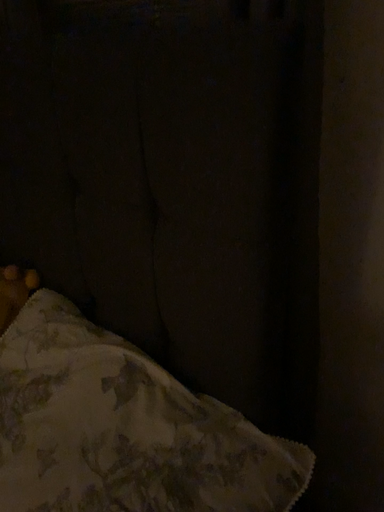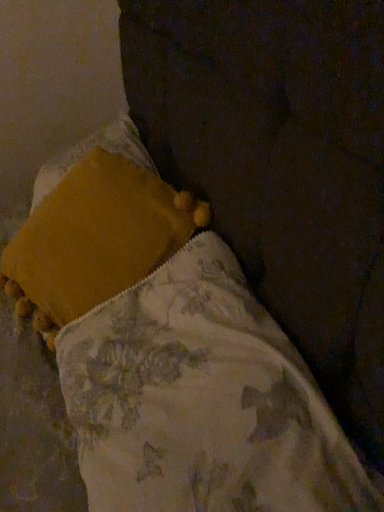
Question: Which way did the camera rotate in the video?

Choices:
 (A) rotated right
 (B) rotated left

Answer: (B)